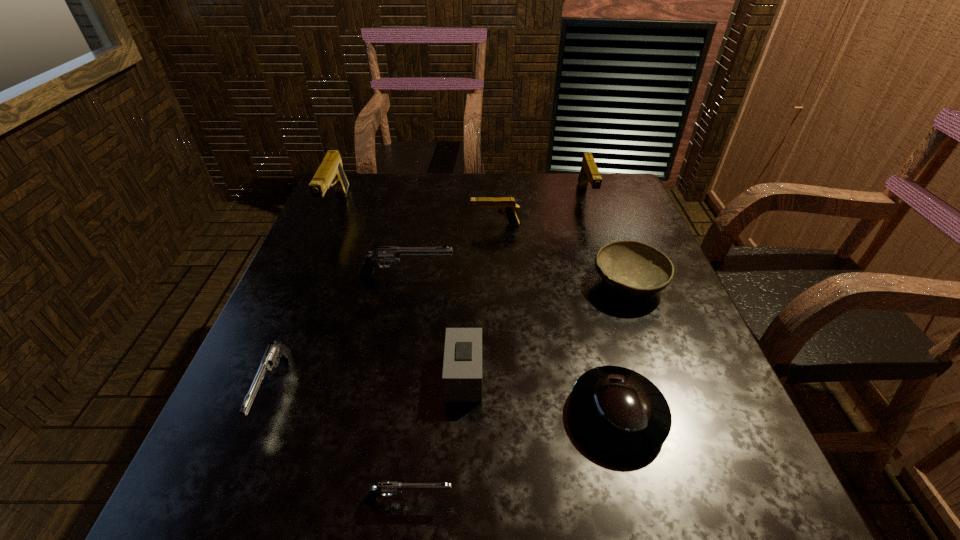
Choose which tan pistol is the nearest neighbor to the smallest tan pistol. Please provide its 2D coordinates. Your answer should be formatted as a tuple, i.e. [(x, y)], where the tuple contains the x and y coordinates of a point satisfying the conditions above.

[(589, 173)]

Identify the location of tan pistol object that ranks as the second closest to the alarm clock. (330, 173).

The width and height of the screenshot is (960, 540). Find the location of `the second closest silver pistol relative to the alarm clock`. the second closest silver pistol relative to the alarm clock is located at coordinates (390, 254).

Locate which silver pistol ranks in proximity to the alarm clock. Please provide its 2D coordinates. Your answer should be formatted as a tuple, i.e. [(x, y)], where the tuple contains the x and y coordinates of a point satisfying the conditions above.

[(386, 488)]

Find the location of a particular element. The image size is (960, 540). vacant area that satisfies the following two spatial constraints: 1. at the barrel of the rightmost pistol; 2. on the front-facing side of the nearest pistol is located at coordinates (686, 500).

Find the location of a particular element. This screenshot has height=540, width=960. vacant space that satisfies the following two spatial constraints: 1. at the barrel of the second tan pistol from left to right; 2. on the right side of the bowl is located at coordinates (497, 284).

At what (x,y) coordinates should I click in order to perform the action: click on blank space that satisfies the following two spatial constraints: 1. at the barrel of the rightmost tan pistol; 2. at the barrel of the second tan pistol from right to left. Please return your answer as a coordinate pair (x, y). Looking at the image, I should click on (595, 225).

Find the location of a particular element. Image resolution: width=960 pixels, height=540 pixels. vacant region that satisfies the following two spatial constraints: 1. at the barrel of the eighth shortest object; 2. on the front-facing side of the alarm clock is located at coordinates (645, 376).